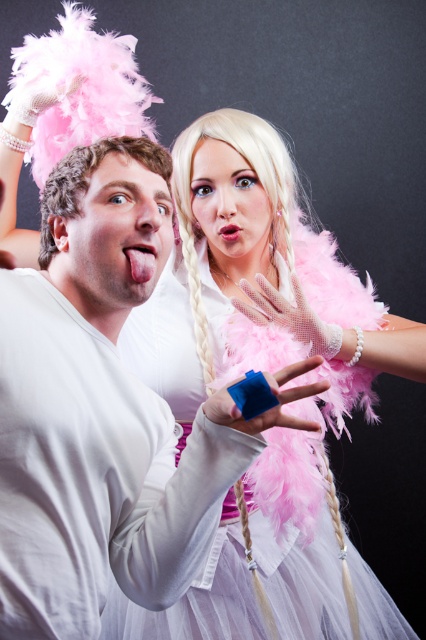
Question: Which of the following is the closest to the observer?

Choices:
 (A) pink mesh glove at center
 (B) curly blonde wig at upper center
 (C) blue plastic ring at center

Answer: (C)

Question: Which point is farther to the camera?

Choices:
 (A) blue plastic ring at center
 (B) blonde feathered wig at upper center
 (C) pink mesh glove at center
 (D) curly blonde wig at upper center

Answer: (B)

Question: Does curly blonde wig at upper center appear under blue plastic ring at center?

Choices:
 (A) yes
 (B) no

Answer: (B)

Question: Among these points, which one is farthest from the camera?

Choices:
 (A) (271, 316)
 (B) (216, 422)
 (C) (199, 342)

Answer: (C)

Question: Can you confirm if blonde feathered wig at upper center is positioned to the left of blue plastic ring at center?

Choices:
 (A) yes
 (B) no

Answer: (B)

Question: Does blonde feathered wig at upper center appear over pink mesh glove at center?

Choices:
 (A) yes
 (B) no

Answer: (A)